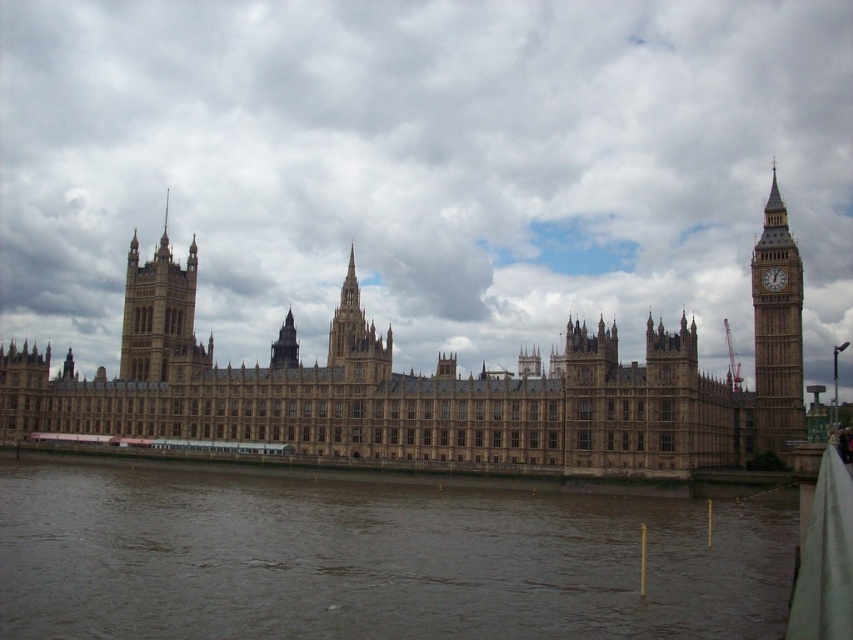
You are a tourist visiting the Palace of Westminster and want to take a photo that includes both the brown stone castle at center and the brown stone tower at upper left. Which object should you position closer to the center of your camera frame to ensure both are fully visible?

You should position the brown stone castle at center closer to the center of your camera frame because it is larger in size compared to the brown stone tower at upper left, ensuring both are fully visible.

You are standing in front of the Palace of Westminster and want to take a photo. You notice two points marked on your camera screen at coordinates point (277, 275) and point (769, 269). Which point is closer to your camera lens?

Point (277, 275) is further to the camera than point (769, 269), so the point closer to the camera lens is point (769, 269).

Looking at this image, you are a tourist standing in front of the Palace of Westminster and want to take a photo that includes both the brown stone castle at center and the brown stone tower at upper left. Which one should you focus on first to ensure both are in the frame?

The brown stone castle at center is taller than the brown stone tower at upper left, so you should focus on the brown stone castle at center first to ensure both are in the frame.